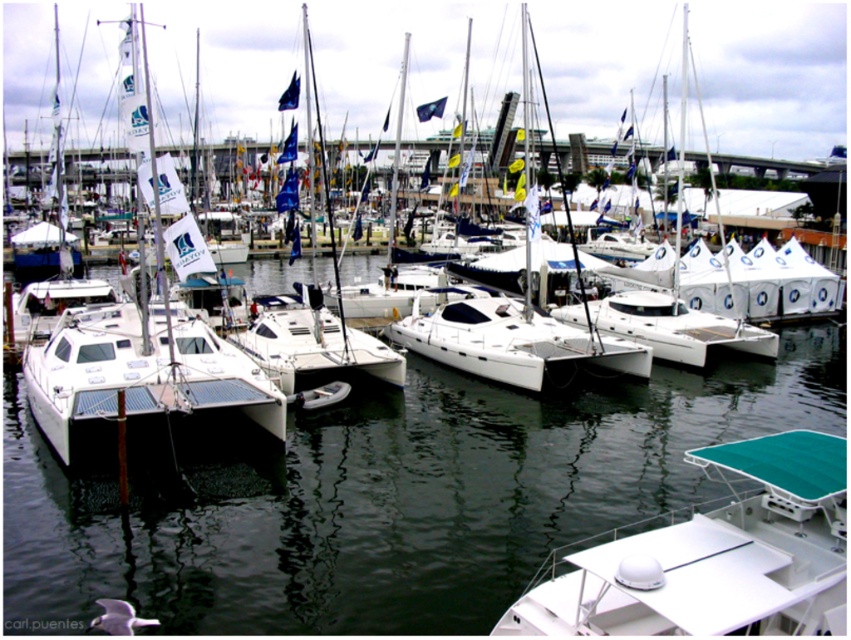
Question: Which object appears closest to the camera in this image?

Choices:
 (A) white glossy water at center
 (B) white matte catamaran at center

Answer: (A)

Question: Which point is farther from the camera taking this photo?

Choices:
 (A) (310, 509)
 (B) (256, 385)

Answer: (B)

Question: Does white glossy water at center appear on the left side of white plastic boat at lower right?

Choices:
 (A) no
 (B) yes

Answer: (A)

Question: Can you confirm if white plastic boat at lower right is smaller than white matte catamaran at center?

Choices:
 (A) yes
 (B) no

Answer: (B)

Question: In this image, where is white glossy water at center located relative to white plastic boat at lower right?

Choices:
 (A) above
 (B) below

Answer: (A)

Question: Considering the real-world distances, which object is closest to the white glossy water at center?

Choices:
 (A) white matte catamaran at center
 (B) white plastic boat at lower right

Answer: (B)